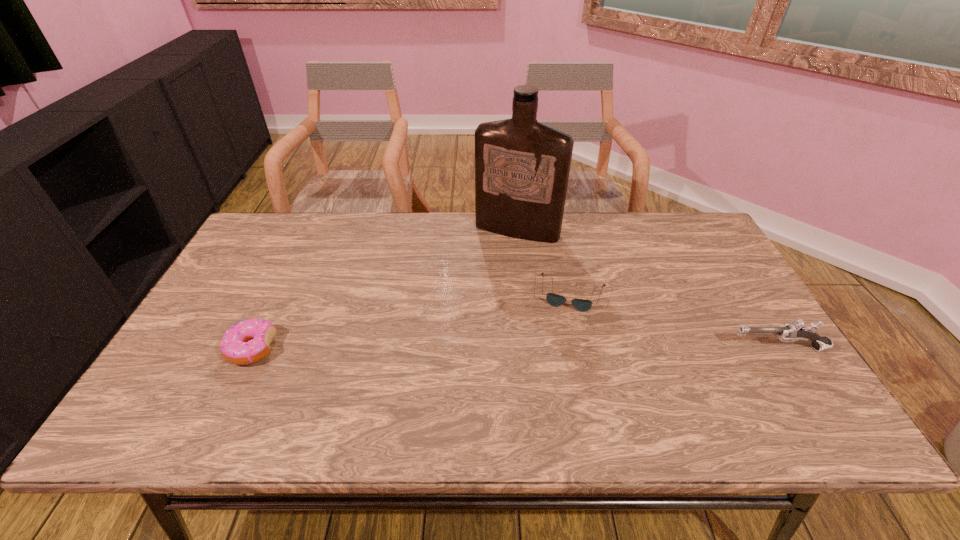
What are the coordinates of `the third closest object relative to the sunglasses` in the screenshot? It's located at (247, 342).

Locate which object ranks second in proximity to the liquor. Please provide its 2D coordinates. Your answer should be formatted as a tuple, i.e. [(x, y)], where the tuple contains the x and y coordinates of a point satisfying the conditions above.

[(794, 331)]

Where is `vacant position in the image that satisfies the following two spatial constraints: 1. on the back side of the rightmost object; 2. aimed along the barrel of the leftmost object`? Image resolution: width=960 pixels, height=540 pixels. vacant position in the image that satisfies the following two spatial constraints: 1. on the back side of the rightmost object; 2. aimed along the barrel of the leftmost object is located at coordinates (252, 348).

Find the location of `free space that satisfies the following two spatial constraints: 1. on the front side of the liquor; 2. aimed along the barrel of the gun`. free space that satisfies the following two spatial constraints: 1. on the front side of the liquor; 2. aimed along the barrel of the gun is located at coordinates (530, 348).

In order to click on blank area in the image that satisfies the following two spatial constraints: 1. on the front side of the farthest object; 2. on the right side of the third nearest object in this screenshot , I will do `click(524, 294)`.

The height and width of the screenshot is (540, 960). I want to click on vacant space that satisfies the following two spatial constraints: 1. on the back side of the third tallest object; 2. aimed along the barrel of the third shortest object, so click(x=252, y=348).

The width and height of the screenshot is (960, 540). Find the location of `free spot that satisfies the following two spatial constraints: 1. on the front side of the sunglasses; 2. on the right side of the farthest object`. free spot that satisfies the following two spatial constraints: 1. on the front side of the sunglasses; 2. on the right side of the farthest object is located at coordinates (524, 294).

In order to click on blank space that satisfies the following two spatial constraints: 1. on the back side of the third tallest object; 2. on the left side of the sunglasses in this screenshot , I will do `click(278, 294)`.